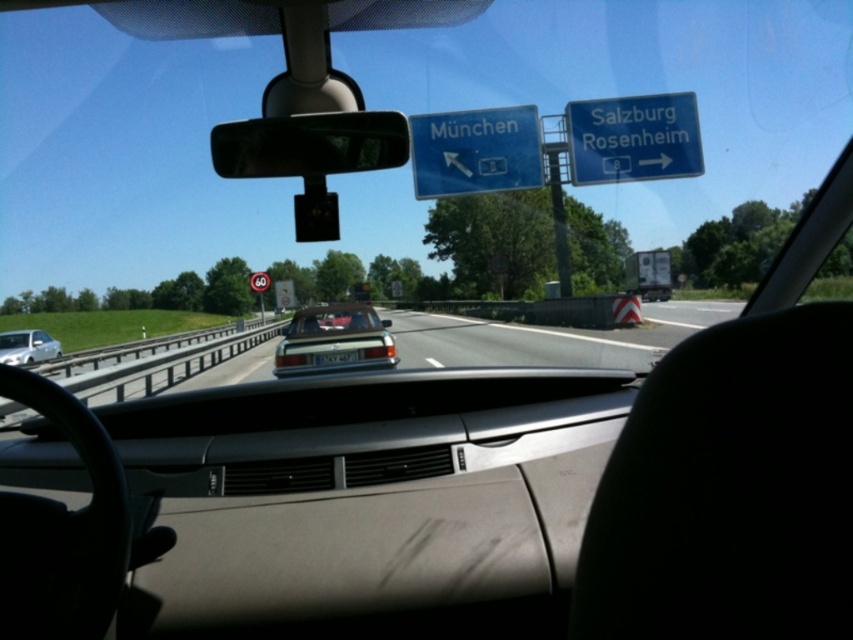
You are driving a car and see the blue plastic sign at upper right and the red circular sign at center. Which one is higher up in your field of view?

The blue plastic sign at upper right is located above the red circular sign at center, so it is higher up in your field of view.

You are driving a car and need to pass through a narrow tunnel that is only wide enough for one vehicle. You see a metallic silver car at center and a white glossy sedan at left. Which vehicle should you avoid overtaking to ensure safe passage through the tunnel?

You should avoid overtaking the metallic silver car at center because it might be wider than the white glossy sedan at left, making it riskier to maneuver in the narrow tunnel.